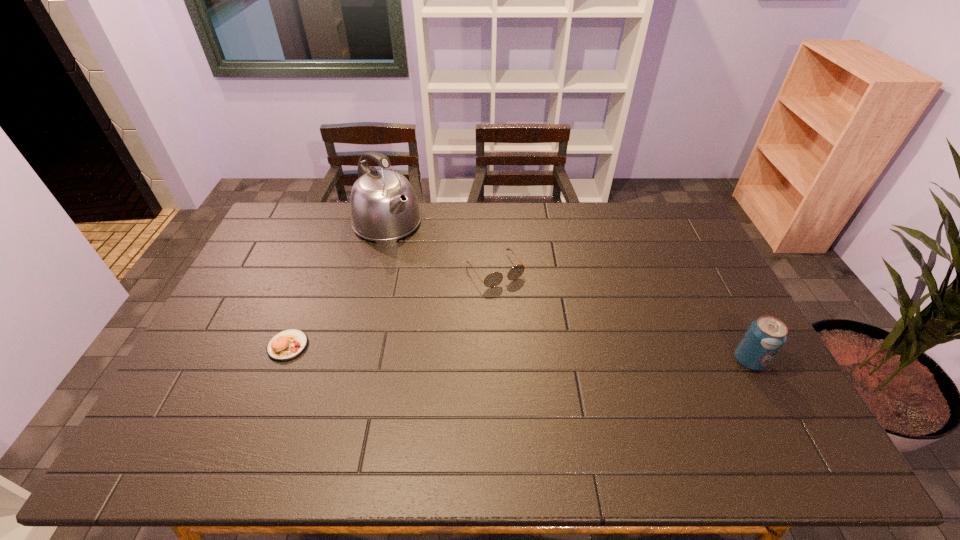
Where is `blank space at the left edge of the desktop`? Image resolution: width=960 pixels, height=540 pixels. blank space at the left edge of the desktop is located at coordinates tap(255, 330).

You are a GUI agent. You are given a task and a screenshot of the screen. Output one action in this format:
    pyautogui.click(x=<x>, y=<y>)
    Task: Click on the free space at the right edge
    
    Given the screenshot: What is the action you would take?
    pyautogui.click(x=710, y=353)

Find the location of `vacant space at the far left corner`. vacant space at the far left corner is located at coordinates (284, 212).

Locate an element on the screen. unoccupied area between the second object from left to right and the second object from right to left is located at coordinates [x=441, y=247].

Where is `empty space that is in between the second object from right to left and the tallest object`? This screenshot has height=540, width=960. empty space that is in between the second object from right to left and the tallest object is located at coordinates (441, 247).

Find the location of `vacant point located between the kettle and the shortest object`. vacant point located between the kettle and the shortest object is located at coordinates (338, 285).

You are a GUI agent. You are given a task and a screenshot of the screen. Output one action in this format:
    pyautogui.click(x=<x>, y=<y>)
    Task: Click on the free space between the third nearest object and the rightmost object
    The height and width of the screenshot is (540, 960).
    Given the screenshot: What is the action you would take?
    pyautogui.click(x=622, y=315)

This screenshot has height=540, width=960. I want to click on vacant space that is in between the third nearest object and the kettle, so click(441, 247).

Locate an element on the screen. The width and height of the screenshot is (960, 540). free space between the shortest object and the second tallest object is located at coordinates (518, 353).

Find the location of a particular element. This screenshot has width=960, height=540. vacant area between the second tallest object and the third nearest object is located at coordinates (622, 315).